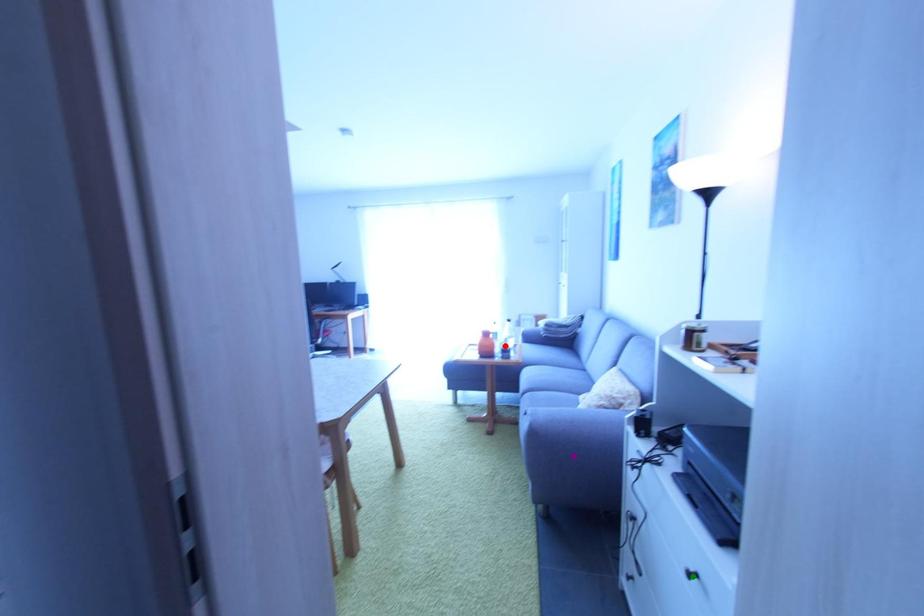
From the picture: Order these from nearest to farthest:
green point
red point
purple point

green point → purple point → red point